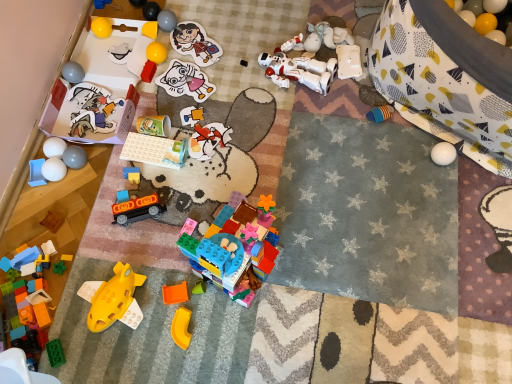
In order to face matte gray ball at left, placed as the seventeenth toy when sorted from right to left, should I rotate leftwards or rightwards?

To face it directly, rotate left by 22.943 degrees.

What is the approximate width of translucent orange plastic toy at center, placed as the 22th toy when sorted from left to right?

The width of translucent orange plastic toy at center, placed as the 22th toy when sorted from left to right, is 4.08 centimeters.

This screenshot has width=512, height=384. I want to click on matte paper sticker at upper center, the sixth toy from the right, so click(195, 43).

Describe the element at coordinates (136, 208) in the screenshot. The height and width of the screenshot is (384, 512). I see `orange matte train at center, placed as the 14th toy when sorted from left to right` at that location.

Find the location of `matte gray ball at left, the ninth toy when ordered from left to right`. matte gray ball at left, the ninth toy when ordered from left to right is located at coordinates (74, 157).

Is yellow rubber ball at upper left, positioned as the 11th toy in right-to-left order, taller than matte gray ball at upper center, which is the 18th toy in left-to-right order?

Indeed, yellow rubber ball at upper left, positioned as the 11th toy in right-to-left order, has a greater height compared to matte gray ball at upper center, which is the 18th toy in left-to-right order.

Image resolution: width=512 pixels, height=384 pixels. I want to click on toy that is the 6th one above the yellow rubber ball at upper left, positioned as the 11th toy in right-to-left order (from a real-world perspective), so click(167, 21).

Could you tell me if yellow rubber ball at upper left, the fifteenth toy viewed from the left, is turned towards matte gray ball at upper center, which is the 18th toy in left-to-right order?

No, yellow rubber ball at upper left, the fifteenth toy viewed from the left, is not turned towards matte gray ball at upper center, which is the 18th toy in left-to-right order.

Does matte cardboard cutout at upper left, positioned as the eleventh toy in left-to-right order, come behind white plastic remote control at upper center, the 24th toy when ordered from left to right?

No, it is not.

Find the location of a particular element. the 13th toy to the left of the white plastic remote control at upper center, the 24th toy when ordered from left to right, counting from the anchor's position is located at coordinates (92, 110).

Is matte cardboard cutout at upper left, positioned as the eleventh toy in left-to-right order, turned away from white plastic remote control at upper center, the 24th toy when ordered from left to right?

matte cardboard cutout at upper left, positioned as the eleventh toy in left-to-right order, is not turned away from white plastic remote control at upper center, the 24th toy when ordered from left to right.

From a real-world perspective, is matte cardboard cutout at upper left, positioned as the eleventh toy in left-to-right order, positioned above or below white plastic remote control at upper center, the 24th toy when ordered from left to right?

In terms of real-world spatial position, matte cardboard cutout at upper left, positioned as the eleventh toy in left-to-right order, is below white plastic remote control at upper center, the 24th toy when ordered from left to right.

Are yellow matte plastic arch at center, which is the 5th toy in right-to-left order, and yellow rubber ball at upper right, the 1th toy when ordered from right to left, far apart?

Absolutely, yellow matte plastic arch at center, which is the 5th toy in right-to-left order, is distant from yellow rubber ball at upper right, the 1th toy when ordered from right to left.

Considering the relative sizes of yellow matte plastic arch at center, which is the 5th toy in right-to-left order, and yellow rubber ball at upper right, the 1th toy when ordered from right to left, in the image provided, is yellow matte plastic arch at center, which is the 5th toy in right-to-left order, shorter than yellow rubber ball at upper right, the 1th toy when ordered from right to left,?

Yes.

Between yellow matte plastic arch at center, which is the 5th toy in right-to-left order, and yellow rubber ball at upper right, the 1th toy when ordered from right to left, which one has smaller width?

yellow matte plastic arch at center, which is the 5th toy in right-to-left order.

The width and height of the screenshot is (512, 384). I want to click on the 21st toy above the yellow matte plastic arch at center, which is the 5th toy in right-to-left order (from the image's perspective), so click(485, 23).

How far apart are wooden block at lower left, which is counted as the sixth toy, starting from the left, and matte cardboard cutout at upper left, positioned as the eleventh toy in left-to-right order?

The distance of wooden block at lower left, which is counted as the sixth toy, starting from the left, from matte cardboard cutout at upper left, positioned as the eleventh toy in left-to-right order, is 35.88 centimeters.

Based on the photo, who is more distant, wooden block at lower left, which is counted as the sixth toy, starting from the left, or matte cardboard cutout at upper left, positioned as the eleventh toy in left-to-right order?

matte cardboard cutout at upper left, positioned as the eleventh toy in left-to-right order, is further away from the camera.

How different are the orientations of wooden block at lower left, which is counted as the 20th toy, starting from the right, and matte cardboard cutout at upper left, which is counted as the 15th toy, starting from the right, in degrees?

The angular difference between wooden block at lower left, which is counted as the 20th toy, starting from the right, and matte cardboard cutout at upper left, which is counted as the 15th toy, starting from the right, is 22.8 degrees.

From a real-world perspective, is wooden block at lower left, which is counted as the sixth toy, starting from the left, located beneath matte cardboard cutout at upper left, which is counted as the 15th toy, starting from the right?

Yes, from a real-world perspective, wooden block at lower left, which is counted as the sixth toy, starting from the left, is below matte cardboard cutout at upper left, which is counted as the 15th toy, starting from the right.

Is rubber yellow ball at upper left, positioned as the tenth toy in left-to-right order, looking in the opposite direction of matte gray ball at upper center, arranged as the eighth toy when viewed from the right?

No, matte gray ball at upper center, arranged as the eighth toy when viewed from the right, is not at the back of rubber yellow ball at upper left, positioned as the tenth toy in left-to-right order.

Between rubber yellow ball at upper left, positioned as the tenth toy in left-to-right order, and matte gray ball at upper center, which is the 18th toy in left-to-right order, which one has larger width?

matte gray ball at upper center, which is the 18th toy in left-to-right order.

Which of these two, rubber yellow ball at upper left, acting as the 16th toy starting from the right, or matte gray ball at upper center, which is the 18th toy in left-to-right order, is smaller?

With smaller size is rubber yellow ball at upper left, acting as the 16th toy starting from the right.

Which is in front, point (105, 24) or point (158, 17)?

The point (105, 24) is closer.

Is yellow matte plastic arch at center, which is the 5th toy in right-to-left order, oriented away from rubber yellow ball at upper left, positioned as the tenth toy in left-to-right order?

No, yellow matte plastic arch at center, which is the 5th toy in right-to-left order, is not facing the opposite direction of rubber yellow ball at upper left, positioned as the tenth toy in left-to-right order.

Based on their sizes in the image, would you say yellow matte plastic arch at center, which is the 5th toy in right-to-left order, is bigger or smaller than rubber yellow ball at upper left, acting as the 16th toy starting from the right?

In the image, yellow matte plastic arch at center, which is the 5th toy in right-to-left order, appears to be smaller than rubber yellow ball at upper left, acting as the 16th toy starting from the right.

Considering the sizes of objects yellow matte plastic arch at center, which appears as the 21th toy when viewed from the left, and rubber yellow ball at upper left, positioned as the tenth toy in left-to-right order, in the image provided, who is shorter, yellow matte plastic arch at center, which appears as the 21th toy when viewed from the left, or rubber yellow ball at upper left, positioned as the tenth toy in left-to-right order,?

yellow matte plastic arch at center, which appears as the 21th toy when viewed from the left, is shorter.

Do you think matte paper sticker at center, the seventh toy viewed from the right, is within white plastic toy at upper left, the 12th toy viewed from the left, or outside of it?

matte paper sticker at center, the seventh toy viewed from the right, is outside white plastic toy at upper left, the 12th toy viewed from the left.

Consider the image. Based on their sizes in the image, would you say matte paper sticker at center, the seventh toy viewed from the right, is bigger or smaller than white plastic toy at upper left, the 12th toy viewed from the left?

Considering their sizes, matte paper sticker at center, the seventh toy viewed from the right, takes up more space than white plastic toy at upper left, the 12th toy viewed from the left.

Who is more distant, matte paper sticker at center, the seventh toy viewed from the right, or white plastic toy at upper left, the 14th toy from the right?

Positioned behind is white plastic toy at upper left, the 14th toy from the right.

Is point (170, 70) closer to camera compared to point (122, 58)?

Yes.

From a real-world perspective, count 6th toys downward from the matte gray ball at upper center, which is the 18th toy in left-to-right order, and point to it. Please provide its 2D coordinates.

[(156, 52)]

You are a GUI agent. You are given a task and a screenshot of the screen. Output one action in this format:
    pyautogui.click(x=<x>, y=<y>)
    Task: Click on the 4th toy below when counting from the white plastic remote control at upper center, which is the second toy from right to left (from the image's perspective)
    
    Given the screenshot: What is the action you would take?
    pyautogui.click(x=92, y=110)

Considering their positions, is matte blue plastic toy at center, acting as the thirteenth toy starting from the left, positioned further to rubber yellow ball at upper left, positioned as the tenth toy in left-to-right order, than white matte robot at upper center, the 3th toy viewed from the right?

Based on the image, white matte robot at upper center, the 3th toy viewed from the right, appears to be further to rubber yellow ball at upper left, positioned as the tenth toy in left-to-right order.

When comparing their distances from translucent orange plastic toy at center, placed as the 22th toy when sorted from left to right, does yellow rubber ball at upper right, arranged as the 25th toy when viewed from the left, or blue plastic blocks at upper left, positioned as the seventh toy in left-to-right order, seem further?

yellow rubber ball at upper right, arranged as the 25th toy when viewed from the left, is further to translucent orange plastic toy at center, placed as the 22th toy when sorted from left to right.

Considering their positions, is white matte eggs at left, placed as the 23th toy when sorted from right to left, positioned further to wooden block at lower left, which is counted as the sixth toy, starting from the left, than translucent blue plastic blocks at lower left, acting as the 24th toy starting from the right?

white matte eggs at left, placed as the 23th toy when sorted from right to left, is further to wooden block at lower left, which is counted as the sixth toy, starting from the left.

Considering their positions, is matte gray ball at upper center, which is the 18th toy in left-to-right order, positioned closer to yellow matte plastic arch at center, which appears as the 21th toy when viewed from the left, than matte blue plastic toy at lower left, acting as the first toy starting from the left?

matte blue plastic toy at lower left, acting as the first toy starting from the left, lies closer to yellow matte plastic arch at center, which appears as the 21th toy when viewed from the left, than the other object.

Based on their spatial positions, is wooden block at lower left, which is counted as the sixth toy, starting from the left, or rubber yellow ball at upper left, acting as the 16th toy starting from the right, further from translucent green plastic toy at lower left, the 18th toy from the right?

rubber yellow ball at upper left, acting as the 16th toy starting from the right, lies further to translucent green plastic toy at lower left, the 18th toy from the right, than the other object.

Considering their positions, is yellow rubber ball at upper right, the 1th toy when ordered from right to left, positioned further to white matte robot at upper center, the 3th toy viewed from the right, than wooden block at lower left, which is counted as the 20th toy, starting from the right?

wooden block at lower left, which is counted as the 20th toy, starting from the right, is positioned further to the anchor white matte robot at upper center, the 3th toy viewed from the right.

When comparing their distances from matte blue plastic toy at center, acting as the thirteenth toy starting from the left, does matte gray ball at left, placed as the seventeenth toy when sorted from right to left, or white matte eggs at left, placed as the 23th toy when sorted from right to left, seem closer?

matte gray ball at left, placed as the seventeenth toy when sorted from right to left, is positioned closer to the anchor matte blue plastic toy at center, acting as the thirteenth toy starting from the left.

Considering their positions, is blue plastic blocks at upper left, the nineteenth toy from the right, positioned closer to matte gray ball at upper center, arranged as the eighth toy when viewed from the right, than rubber yellow ball at upper left, acting as the 16th toy starting from the right?

Among the two, rubber yellow ball at upper left, acting as the 16th toy starting from the right, is located nearer to matte gray ball at upper center, arranged as the eighth toy when viewed from the right.

Where is `toy between white matte robot at upper center, positioned as the 23th toy in left-to-right order, and yellow rubber ball at upper right, the 1th toy when ordered from right to left`? The width and height of the screenshot is (512, 384). toy between white matte robot at upper center, positioned as the 23th toy in left-to-right order, and yellow rubber ball at upper right, the 1th toy when ordered from right to left is located at coordinates (348, 61).

Where is `toy between wooden block at lower left, which is counted as the 20th toy, starting from the right, and translucent green plastic toy at lower left, which is the 8th toy in left-to-right order, in the up-down direction`? The image size is (512, 384). toy between wooden block at lower left, which is counted as the 20th toy, starting from the right, and translucent green plastic toy at lower left, which is the 8th toy in left-to-right order, in the up-down direction is located at coordinates (30, 259).